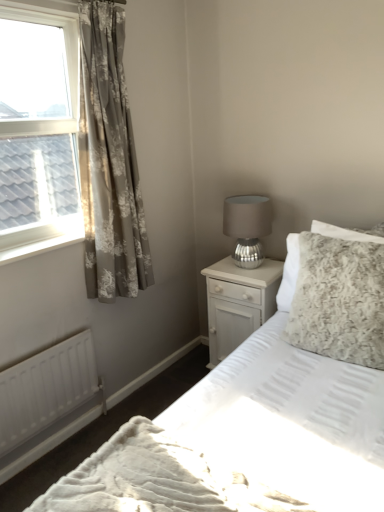
What is the approximate height of floral-patterned fabric curtain at left?

The height of floral-patterned fabric curtain at left is 1.41 meters.

Where is `white textured bed at center`? Image resolution: width=384 pixels, height=512 pixels. white textured bed at center is located at coordinates (244, 448).

Image resolution: width=384 pixels, height=512 pixels. Describe the element at coordinates (38, 131) in the screenshot. I see `clear glass window at upper left` at that location.

The width and height of the screenshot is (384, 512). Identify the location of clear glass window at upper left. tap(38, 131).

I want to click on floral-patterned fabric curtain at left, so click(109, 162).

Is white textured bed at center at the back of white painted wood at left?

No.

From the image's perspective, is white painted wood at left beneath white textured bed at center?

Incorrect, from the image's perspective, white painted wood at left is higher than white textured bed at center.

How many degrees apart are the facing directions of white painted wood at left and white textured bed at center?

91.9 degrees separate the facing orientations of white painted wood at left and white textured bed at center.

Which object is positioned more to the right, white painted wood at left or white textured bed at center?

From the viewer's perspective, white textured bed at center appears more on the right side.

How distant is floral-patterned fabric curtain at left from clear glass window at upper left?

floral-patterned fabric curtain at left is 8.86 inches away from clear glass window at upper left.

From the image's perspective, would you say floral-patterned fabric curtain at left is positioned over clear glass window at upper left?

No, from the image's perspective, floral-patterned fabric curtain at left is not on top of clear glass window at upper left.

Which is in front, floral-patterned fabric curtain at left or clear glass window at upper left?

clear glass window at upper left is more forward.

Is floral-patterned fabric curtain at left taller or shorter than clear glass window at upper left?

Considering their sizes, floral-patterned fabric curtain at left has more height than clear glass window at upper left.

I want to click on table lamp on the left of fluffy white pillow at right, so pyautogui.click(x=247, y=227).

Which is in front, fluffy white pillow at right or silver textured lamp at upper right?

fluffy white pillow at right is in front.

Does fluffy white pillow at right have a larger size compared to silver textured lamp at upper right?

Correct, fluffy white pillow at right is larger in size than silver textured lamp at upper right.

From a real-world perspective, which object rests below the other?

fluffy white pillow at right is physically lower.

Is white textured bed at center at the right side of floral-patterned fabric curtain at left?

Correct, you'll find white textured bed at center to the right of floral-patterned fabric curtain at left.

Could you tell me if white textured bed at center is facing floral-patterned fabric curtain at left?

No, white textured bed at center is not facing towards floral-patterned fabric curtain at left.

From the image's perspective, is white textured bed at center over floral-patterned fabric curtain at left?

No, from the image's perspective, white textured bed at center is not on top of floral-patterned fabric curtain at left.

At what (x,y) coordinates should I click in order to perform the action: click on bed on the right of the floral-patterned fabric curtain at left. Please return your answer as a coordinate pair (x, y). Image resolution: width=384 pixels, height=512 pixels. Looking at the image, I should click on (244, 448).

Looking at this image, considering the sizes of silver textured lamp at upper right and white glossy nightstand at center-right in the image, is silver textured lamp at upper right taller or shorter than white glossy nightstand at center-right?

silver textured lamp at upper right is shorter than white glossy nightstand at center-right.

Would you say silver textured lamp at upper right contains white glossy nightstand at center-right?

No, white glossy nightstand at center-right is located outside of silver textured lamp at upper right.

Does silver textured lamp at upper right come behind white glossy nightstand at center-right?

No, silver textured lamp at upper right is closer to the camera.

Looking at this image, looking at the image, does silver textured lamp at upper right seem bigger or smaller compared to white glossy nightstand at center-right?

silver textured lamp at upper right is smaller than white glossy nightstand at center-right.

From a real-world perspective, which is physically below, fluffy white pillow at right or floral-patterned fabric curtain at left?

fluffy white pillow at right.

Which of these two, fluffy white pillow at right or floral-patterned fabric curtain at left, is wider?

With larger width is fluffy white pillow at right.

Is fluffy white pillow at right behind floral-patterned fabric curtain at left?

No, fluffy white pillow at right is in front of floral-patterned fabric curtain at left.

Is white glossy nightstand at center-right with fluffy white pillow at right?

white glossy nightstand at center-right is not next to fluffy white pillow at right, and they're not touching.

Locate an element on the screen. The width and height of the screenshot is (384, 512). nightstand lying below the fluffy white pillow at right (from the image's perspective) is located at coordinates (238, 303).

Which object is positioned more to the left, white glossy nightstand at center-right or fluffy white pillow at right?

Positioned to the left is white glossy nightstand at center-right.

Which is in front, white glossy nightstand at center-right or fluffy white pillow at right?

fluffy white pillow at right is in front.

At what (x,y) coordinates should I click in order to perform the action: click on bed lying below the white painted wood at left (from the image's perspective). Please return your answer as a coordinate pair (x, y). Looking at the image, I should click on (244, 448).

Image resolution: width=384 pixels, height=512 pixels. Find the location of `curtain behind the clear glass window at upper left`. curtain behind the clear glass window at upper left is located at coordinates (109, 162).

Considering their positions, is clear glass window at upper left positioned closer to white matte radiator at lower left than white glossy nightstand at center-right?

clear glass window at upper left.

From the image, which object appears to be farther from white textured bed at center, white painted wood at left or floral-patterned fabric curtain at left?

Based on the image, white painted wood at left appears to be further to white textured bed at center.

Which object lies further to the anchor point fluffy white pillow at right, white matte radiator at lower left or white painted wood at left?

Among the two, white painted wood at left is located further to fluffy white pillow at right.

Based on their spatial positions, is white matte radiator at lower left or silver textured lamp at upper right closer to white painted wood at left?

white matte radiator at lower left.

Based on their spatial positions, is fluffy white pillow at right or white matte radiator at lower left closer to white painted wood at left?

Based on the image, white matte radiator at lower left appears to be nearer to white painted wood at left.

Estimate the real-world distances between objects in this image. Which object is further from clear glass window at upper left, white matte radiator at lower left or silver textured lamp at upper right?

silver textured lamp at upper right is further to clear glass window at upper left.

Looking at the image, which one is located closer to white matte radiator at lower left, floral-patterned fabric curtain at left or white glossy nightstand at center-right?

floral-patterned fabric curtain at left is positioned closer to the anchor white matte radiator at lower left.

Which object lies further to the anchor point white matte radiator at lower left, white glossy nightstand at center-right or fluffy white pillow at right?

Among the two, fluffy white pillow at right is located further to white matte radiator at lower left.

Find the location of `curtain between white textured bed at center and silver textured lamp at upper right from front to back`. curtain between white textured bed at center and silver textured lamp at upper right from front to back is located at coordinates (109, 162).

Find the location of a particular element. curtain between white matte radiator at lower left and fluffy white pillow at right is located at coordinates (109, 162).

This screenshot has height=512, width=384. In order to click on table lamp between floral-patterned fabric curtain at left and white matte radiator at lower left from top to bottom in this screenshot , I will do `click(247, 227)`.

Locate an element on the screen. curtain between clear glass window at upper left and silver textured lamp at upper right is located at coordinates (109, 162).